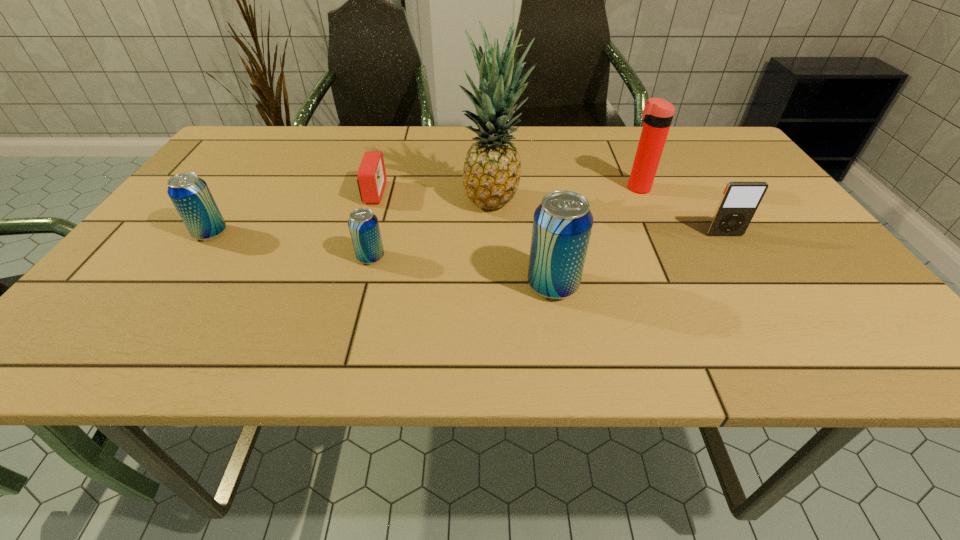
Locate an element on the screen. free space that satisfies the following two spatial constraints: 1. on the front-facing side of the shortest object; 2. on the right side of the third tallest object is located at coordinates (345, 285).

Locate an element on the screen. This screenshot has height=540, width=960. vacant space that satisfies the following two spatial constraints: 1. on the front-facing side of the tallest object; 2. on the right side of the shortest object is located at coordinates (371, 202).

Where is `free space that satisfies the following two spatial constraints: 1. on the front-facing side of the tallest object; 2. on the right side of the alarm clock`? Image resolution: width=960 pixels, height=540 pixels. free space that satisfies the following two spatial constraints: 1. on the front-facing side of the tallest object; 2. on the right side of the alarm clock is located at coordinates (371, 202).